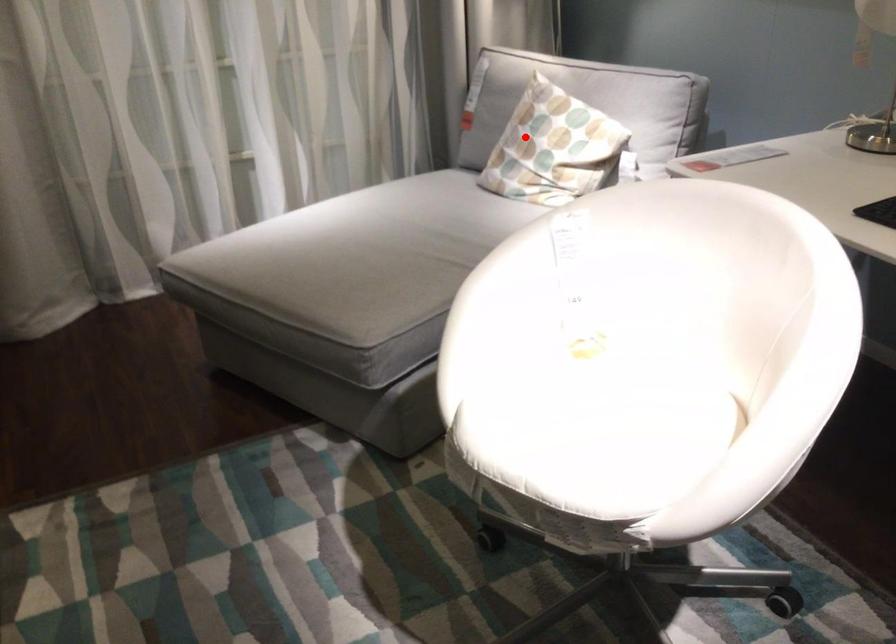
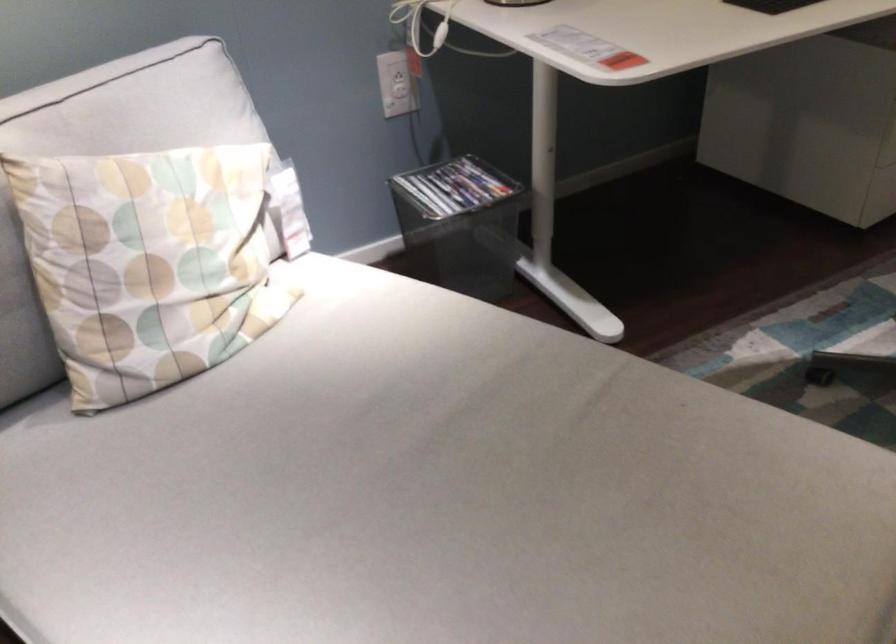
Find the pixel in the second image that matches the highlighted location in the first image.

(149, 263)